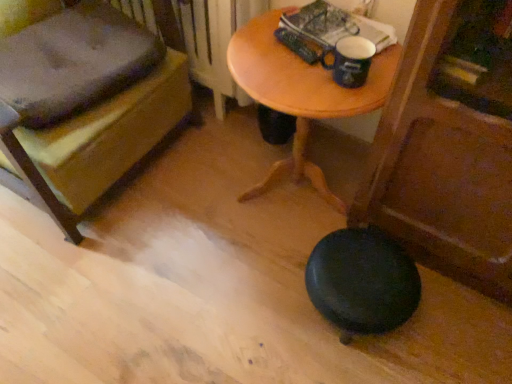
Where is `vacant area on top of wooden table at center (from a real-world perspective)`? The image size is (512, 384). vacant area on top of wooden table at center (from a real-world perspective) is located at coordinates (298, 60).